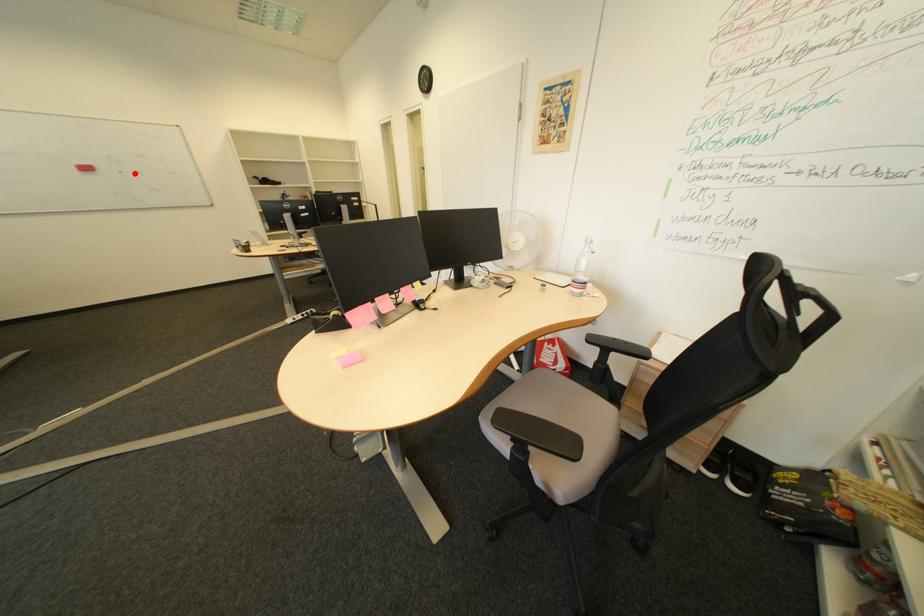
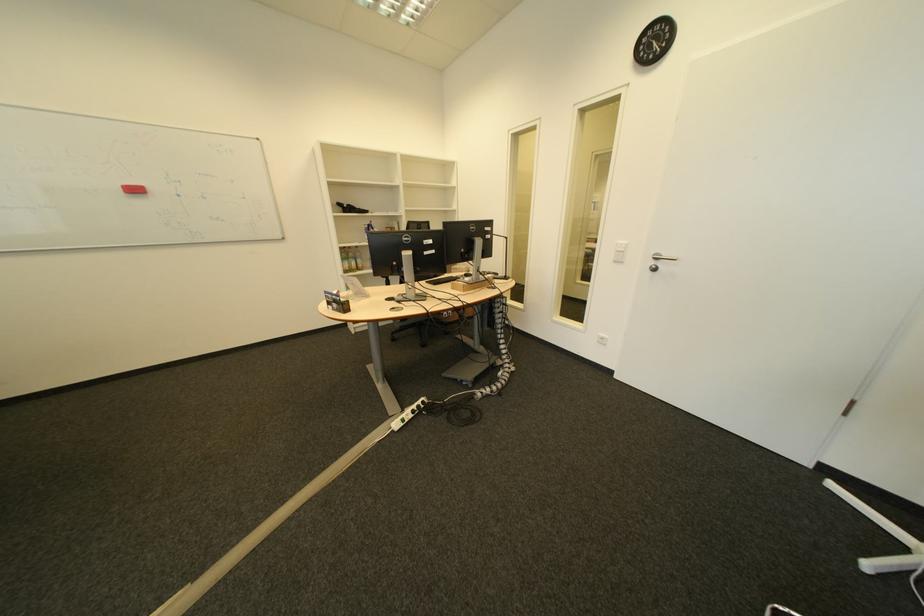
Find the pixel in the second image that matches the highlighted location in the first image.

(192, 197)